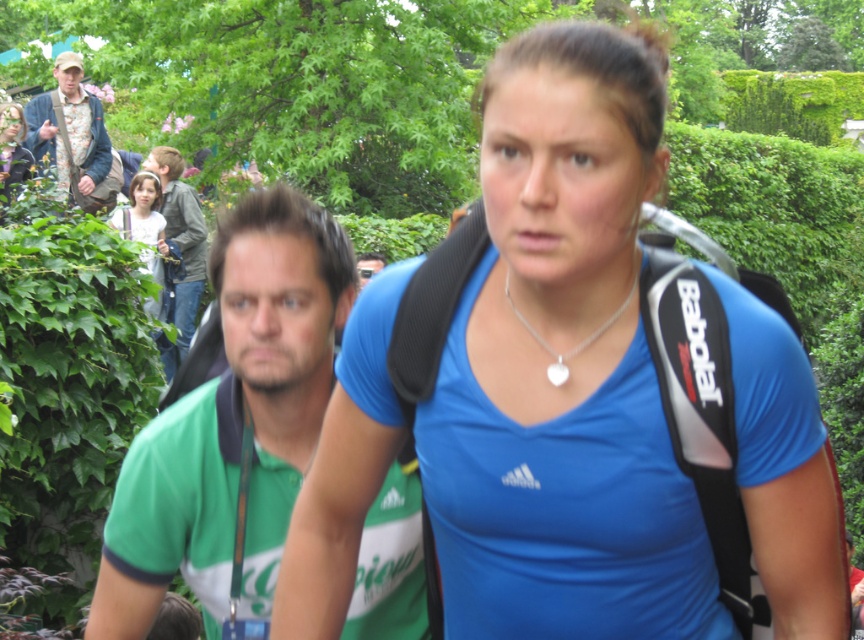
You are standing at the center of the image and looking towards the upper left corner. Which object, the green fabric shirt at upper left or the light brown hair at upper left, is positioned higher in the image?

The green fabric shirt at upper left is positioned higher than the light brown hair at upper left in the image.

You are a photographer trying to capture a clear shot of the light brown hair at upper left and the green fabric shirt at center. Based on their sizes in the frame, which one should you focus on to ensure it fills the frame better?

The light brown hair at upper left has a larger width than the green fabric shirt at center, so focusing on the light brown hair at upper left will fill the frame better.